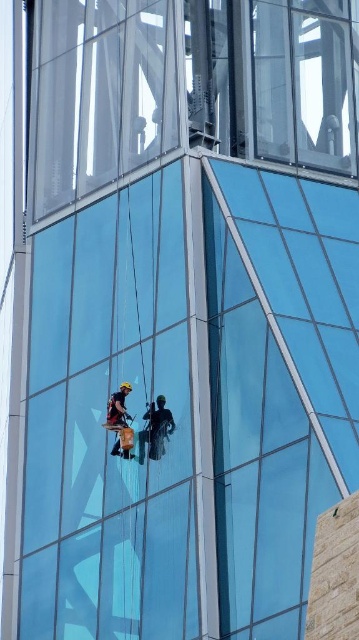
You are standing at the base of the modern building with a glass facade. You want to throw a small pebble to hit the point marked as point [142,432]. Given that the maximum distance you can throw is 75 meters, will your throw reach the point?

The point [142,432] is 74.81 meters away from the viewer. Since your maximum throw distance is 75 meters, you can reach the point.

You are a window cleaner planning to clean the transparent glass window at upper center and the dark blue fabric at center. Since the fabric might require a different cleaning method, which object should you clean first based on their sizes?

The transparent glass window at upper center has a larger width than the dark blue fabric at center, so you should clean the transparent glass window at upper center first since it requires more attention due to its size.

You are standing at the camera position and want to reach the point at coordinates point (x=342, y=122). If you walk straight towards it, how far will you have to walk?

The point at coordinates point (x=342, y=122) is 277.58 feet away from the camera position, so you will have to walk 277.58 feet straight towards it to reach there.